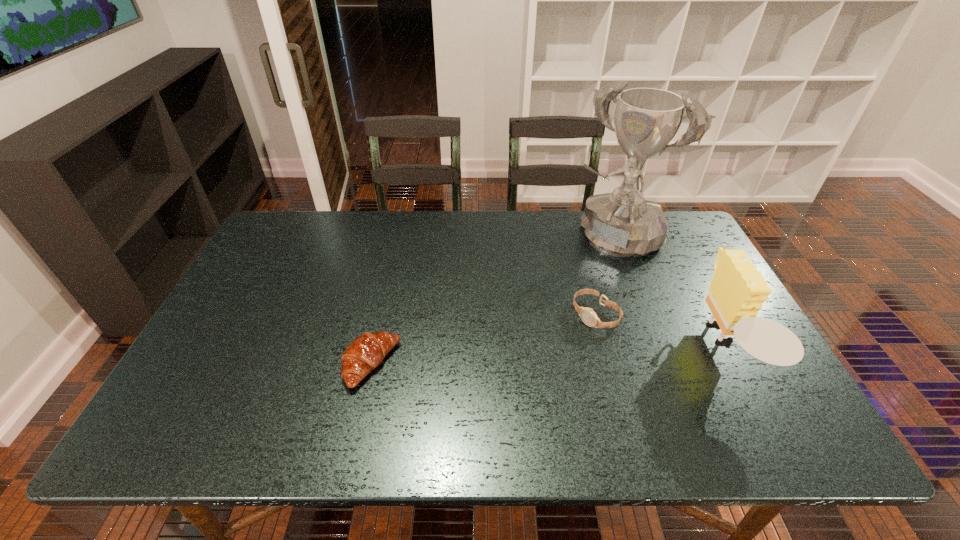
Identify the location of vacant space at the near edge. The height and width of the screenshot is (540, 960). (431, 397).

The image size is (960, 540). Find the location of `vacant position at the left edge of the desktop`. vacant position at the left edge of the desktop is located at coordinates (251, 274).

Identify the location of vacant area at the right edge. (685, 300).

This screenshot has width=960, height=540. Find the location of `free space at the far left corner of the desktop`. free space at the far left corner of the desktop is located at coordinates (291, 247).

Where is `vacant space that is in between the watch and the leftmost object`? The image size is (960, 540). vacant space that is in between the watch and the leftmost object is located at coordinates (483, 340).

Identify the location of vacant area that lies between the second tallest object and the watch. (659, 331).

I want to click on vacant point located between the leftmost object and the watch, so click(483, 340).

The image size is (960, 540). I want to click on empty space between the leftmost object and the watch, so click(x=483, y=340).

Locate an element on the screen. This screenshot has height=540, width=960. blank region between the award and the leftmost object is located at coordinates (492, 300).

Where is `vacant area between the leftmost object and the second tallest object`? vacant area between the leftmost object and the second tallest object is located at coordinates (546, 356).